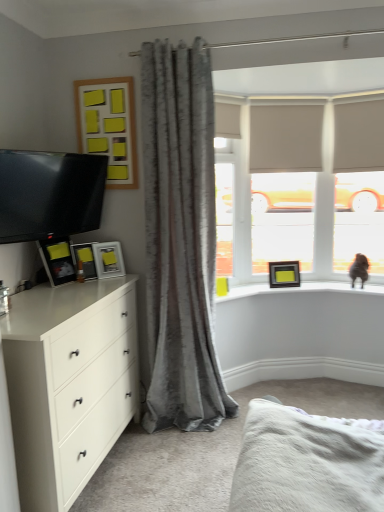
Question: Is matte black picture frame at upper right, the 5th picture frame when ordered from top to bottom, completely or partially outside of wooden frame with yellow sticky notes at upper left, which ranks as the 4th picture frame in back-to-front order?

Choices:
 (A) yes
 (B) no

Answer: (A)

Question: Would you say matte black picture frame at upper right, which is the fifth picture frame from front to back, contains wooden frame with yellow sticky notes at upper left, marked as the 2th picture frame in a front-to-back arrangement?

Choices:
 (A) yes
 (B) no

Answer: (B)

Question: Considering the relative sizes of matte black picture frame at upper right, which is the first picture frame in right-to-left order, and wooden frame with yellow sticky notes at upper left, the 1th picture frame viewed from the top, in the image provided, is matte black picture frame at upper right, which is the first picture frame in right-to-left order, wider than wooden frame with yellow sticky notes at upper left, the 1th picture frame viewed from the top,?

Choices:
 (A) yes
 (B) no

Answer: (A)

Question: From a real-world perspective, is matte black picture frame at upper right, which ranks as the 5th picture frame in left-to-right order, physically below wooden frame with yellow sticky notes at upper left, the 1th picture frame viewed from the top?

Choices:
 (A) yes
 (B) no

Answer: (A)

Question: Is there a large distance between matte black picture frame at upper right, the first picture frame in the bottom-to-top sequence, and wooden frame with yellow sticky notes at upper left, which ranks as the 4th picture frame in back-to-front order?

Choices:
 (A) yes
 (B) no

Answer: (A)

Question: Can you confirm if matte black picture frame at upper right, arranged as the 1th picture frame when viewed from the back, is thinner than wooden frame with yellow sticky notes at upper left, the 1th picture frame viewed from the top?

Choices:
 (A) no
 (B) yes

Answer: (A)

Question: From a real-world perspective, is wooden frame with yellow sticky notes at upper left, acting as the fifth picture frame starting from the bottom, on matte black picture frame at left, the 4th picture frame when ordered from right to left?

Choices:
 (A) yes
 (B) no

Answer: (A)

Question: Does wooden frame with yellow sticky notes at upper left, the 1th picture frame viewed from the top, have a smaller size compared to matte black picture frame at left, the 4th picture frame when ordered from right to left?

Choices:
 (A) no
 (B) yes

Answer: (A)

Question: Can you confirm if wooden frame with yellow sticky notes at upper left, the 1th picture frame viewed from the top, is taller than matte black picture frame at left, the 4th picture frame when ordered from right to left?

Choices:
 (A) yes
 (B) no

Answer: (A)

Question: From a real-world perspective, is wooden frame with yellow sticky notes at upper left, which ranks as the 3th picture frame in right-to-left order, positioned under matte black picture frame at left, which is the 4th picture frame from top to bottom, based on gravity?

Choices:
 (A) yes
 (B) no

Answer: (B)

Question: Does wooden frame with yellow sticky notes at upper left, which ranks as the 4th picture frame in back-to-front order, have a lesser width compared to matte black picture frame at left, the 4th picture frame when ordered from right to left?

Choices:
 (A) yes
 (B) no

Answer: (A)

Question: Does wooden frame with yellow sticky notes at upper left, acting as the fifth picture frame starting from the bottom, appear on the left side of matte black picture frame at left, which is the 4th picture frame from top to bottom?

Choices:
 (A) no
 (B) yes

Answer: (A)

Question: Is matte black picture frame at upper right, the 5th picture frame when ordered from top to bottom, thinner than brown furry cat at upper right?

Choices:
 (A) no
 (B) yes

Answer: (B)